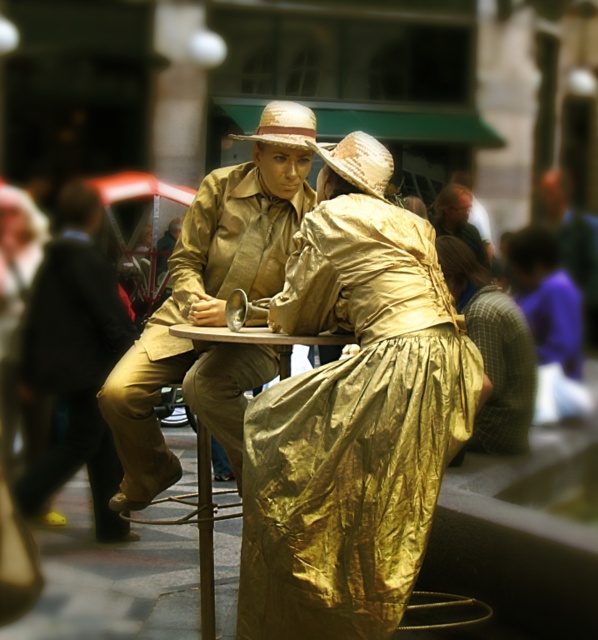
You are a photographer standing at the edge of the scene. You want to capture a photo where both the gold shiny dress at center and the matte black suit at left are in focus. Given that your camera can only focus on objects within a 3.5 meter range, will you be able to achieve this?

The distance between the gold shiny dress at center and the matte black suit at left is 3.65 meters, which exceeds the camera focus range of 3.5 meters. Therefore, it will be difficult to keep both in focus simultaneously.

You are a photographer trying to capture both the matte khaki jacket at center and the gold foil dress at center in the same frame. The camera you are using has a maximum focus range of 8 meters. Can you ensure both subjects are in focus without moving closer?

The matte khaki jacket at center is 9.02 meters from the gold foil dress at center. Since the camera can only focus up to 8 meters, the distance between them exceeds the camera limit. Therefore, both subjects cannot be in focus simultaneously without moving closer.